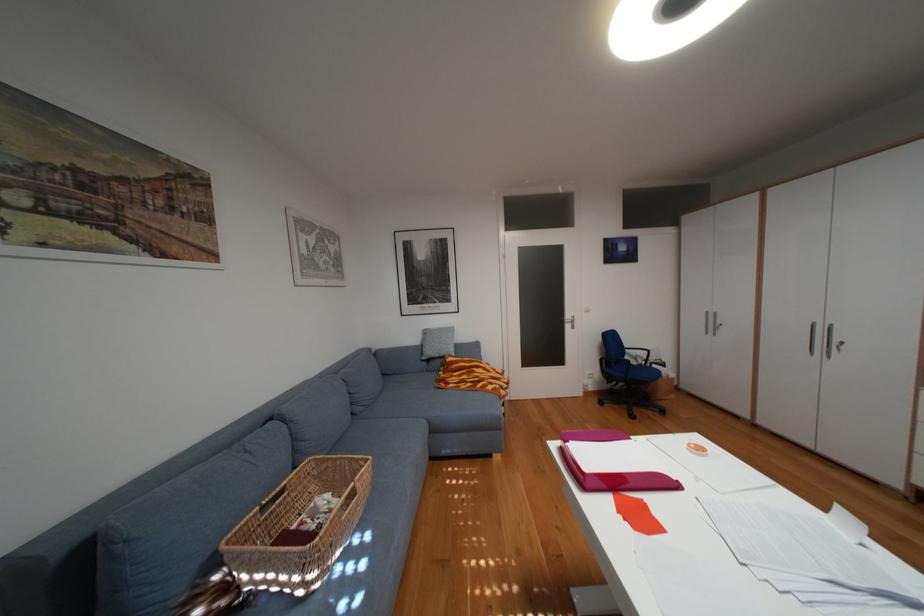
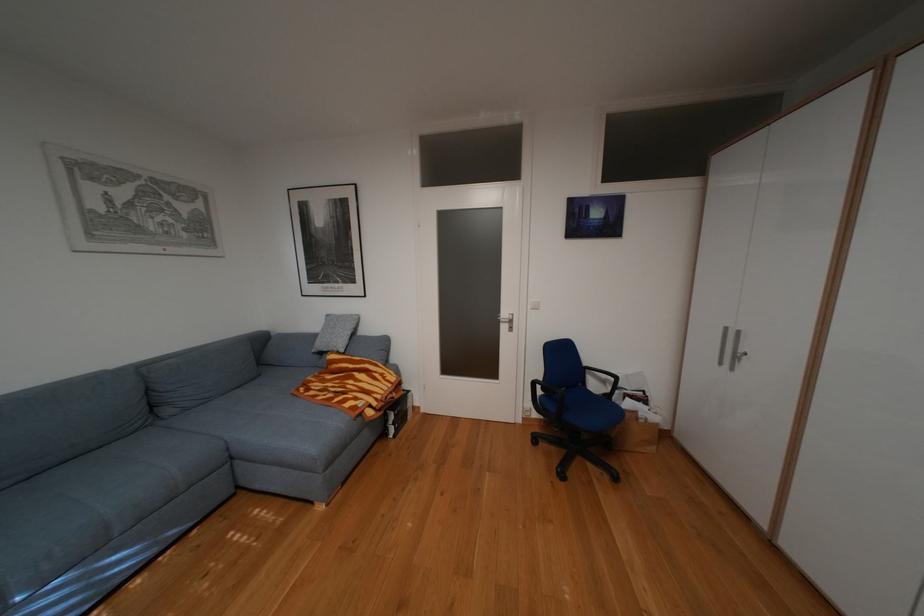
The images are taken continuously from a first-person perspective. In which direction are you moving?

The cameraman moved toward right, forward.